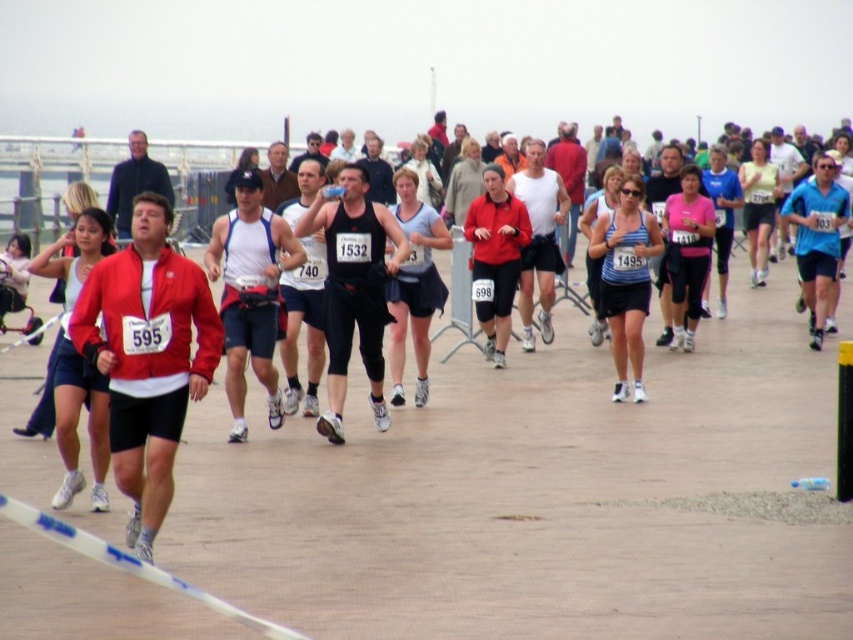
You are a photographer positioned at the starting line of the race. You want to capture a photo of the blue striped tank top at center and the matte black shorts at center. Which clothing item will appear shorter in the photo?

The blue striped tank top at center is not as tall as matte black shorts at center, so the blue striped tank top at center will appear shorter in the photo.

You are a photographer positioned at the starting line of the race. You want to capture a photo of the blue striped tank top at center and the matte black shorts at center. Based on their positions, which one would appear lower in the photo?

The blue striped tank top at center appears lower in the photo because it is positioned below the matte black shorts at center.